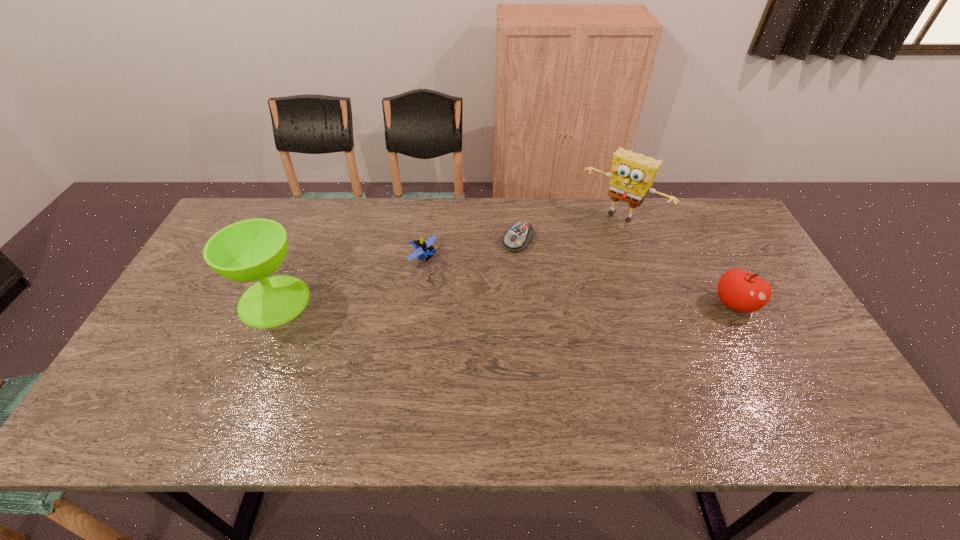
I want to click on free area in between the third shortest object and the Lego, so click(x=579, y=280).

Identify the location of empty location between the sponge and the third shortest object. This screenshot has width=960, height=540. click(x=678, y=261).

Where is `blank region between the second object from left to right and the third object from left to right`? This screenshot has width=960, height=540. blank region between the second object from left to right and the third object from left to right is located at coordinates (470, 248).

Where is `blank region between the sponge and the computer mouse`? Image resolution: width=960 pixels, height=540 pixels. blank region between the sponge and the computer mouse is located at coordinates (569, 228).

Identify the location of blank region between the leftmost object and the third shortest object. (504, 303).

Image resolution: width=960 pixels, height=540 pixels. I want to click on free space between the sponge and the leftmost object, so click(447, 259).

You are a GUI agent. You are given a task and a screenshot of the screen. Output one action in this format:
    pyautogui.click(x=<x>, y=<y>)
    Task: Click on the empty space between the third object from right to left and the apple
    
    Given the screenshot: What is the action you would take?
    pyautogui.click(x=626, y=272)

Find the location of a particular element. object that is the second closest one to the shortest object is located at coordinates 423,248.

What are the coordinates of `the fourth closest object to the sponge` in the screenshot? It's located at (250, 250).

Locate an element on the screen. This screenshot has width=960, height=540. vacant space that satisfies the following two spatial constraints: 1. on the back side of the fourth object from left to right; 2. on the right side of the leftmost object is located at coordinates (310, 217).